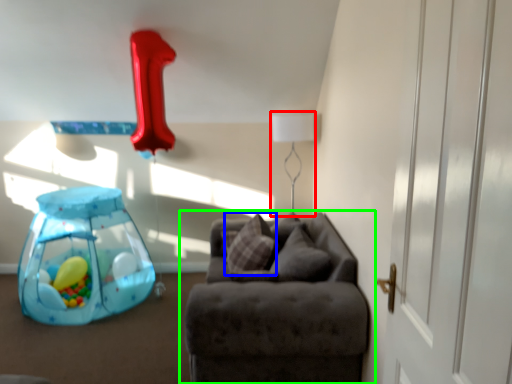
Question: Which is nearer to the table lamp (highlighted by a red box)? pillow (highlighted by a blue box) or studio couch (highlighted by a green box).

Choices:
 (A) pillow
 (B) studio couch

Answer: (A)